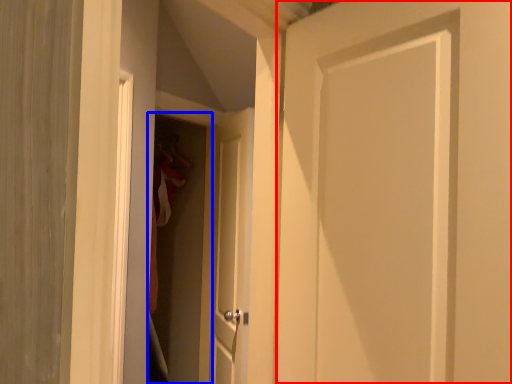
Question: Among these objects, which one is farthest to the camera, door (highlighted by a red box) or screen door (highlighted by a blue box)?

Choices:
 (A) door
 (B) screen door

Answer: (B)